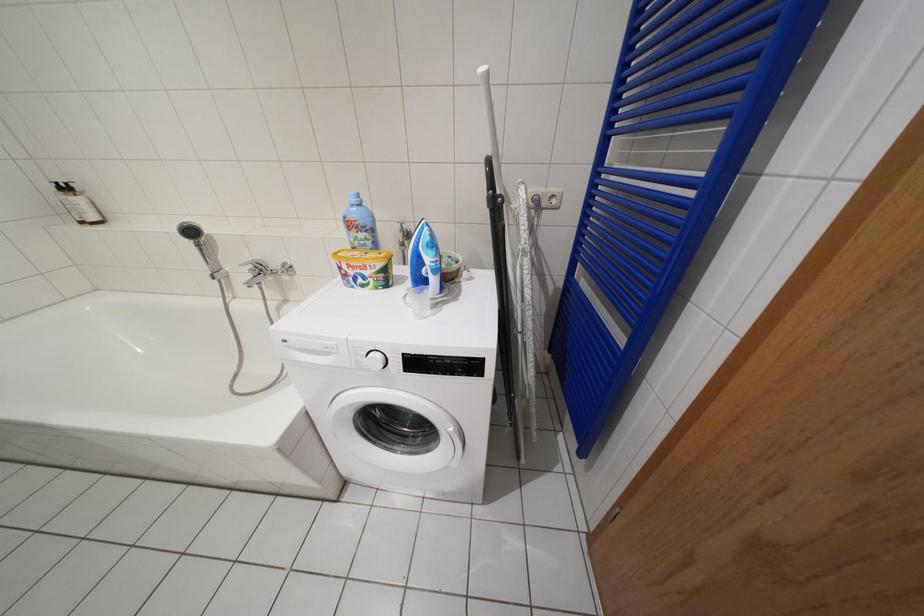
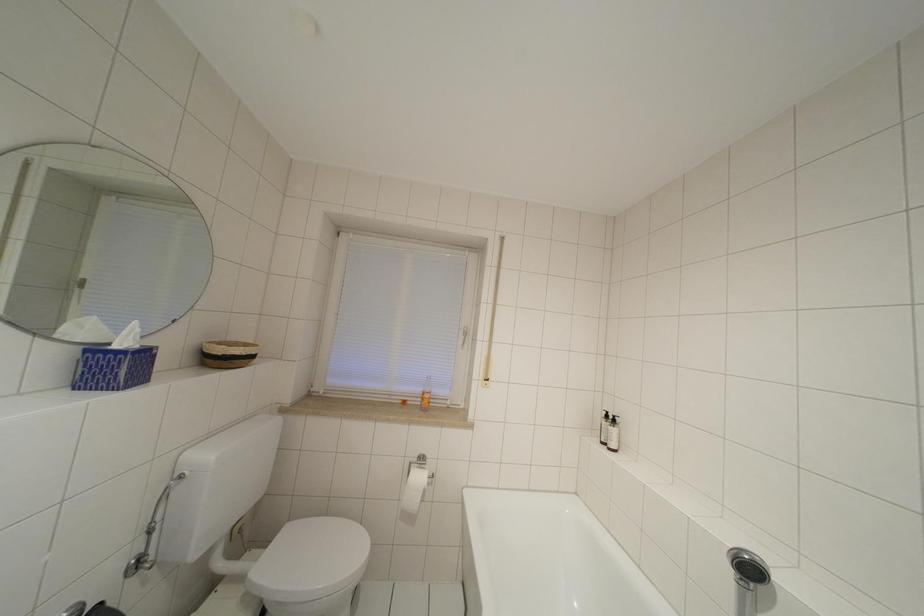
Question: How did the camera likely rotate?

Choices:
 (A) Left
 (B) Right
 (C) Up
 (D) Down

Answer: (A)